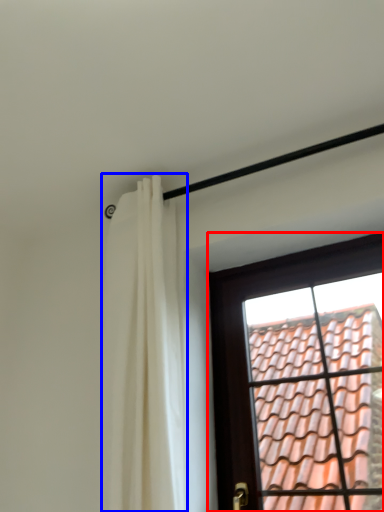
Question: Which object appears farthest to the camera in this image, window (highlighted by a red box) or curtain (highlighted by a blue box)?

Choices:
 (A) window
 (B) curtain

Answer: (A)